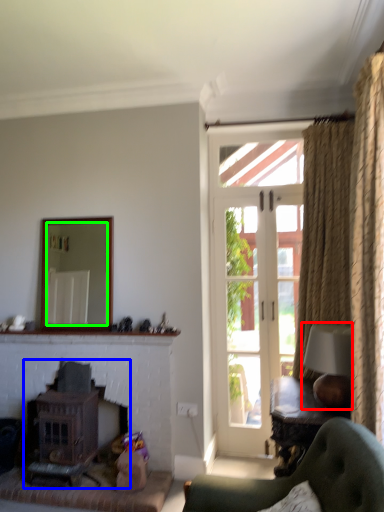
Question: Which is nearer to the lamp (highlighted by a red box)? fireplace (highlighted by a blue box) or mirror (highlighted by a green box).

Choices:
 (A) fireplace
 (B) mirror

Answer: (B)